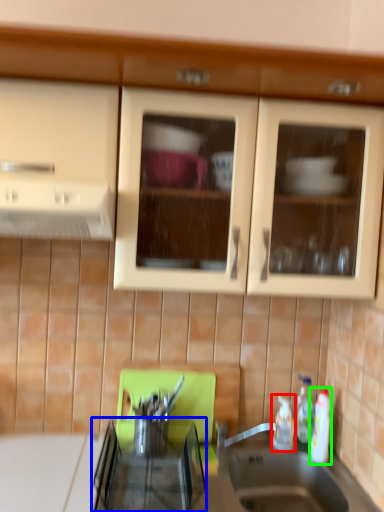
Question: Estimate the real-world distances between objects in this image. Which object is closer to bottle (highlighted by a red box), appliance (highlighted by a blue box) or bottle (highlighted by a green box)?

Choices:
 (A) appliance
 (B) bottle

Answer: (B)